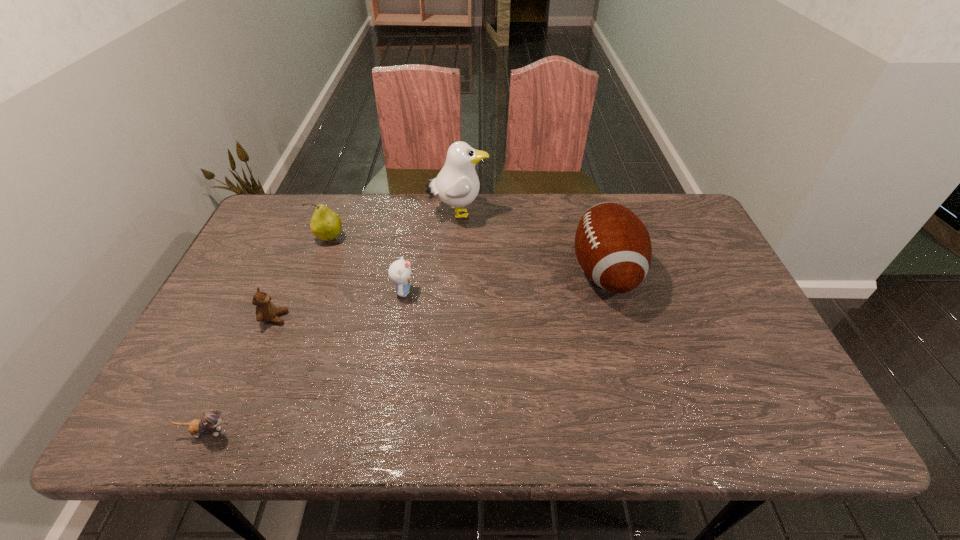
Where is `empty location between the farthest object and the third tallest object`? empty location between the farthest object and the third tallest object is located at coordinates (394, 226).

Locate an element on the screen. object that is the second closest to the left kitten is located at coordinates (399, 271).

The image size is (960, 540). In order to click on the fourth closest object to the teddy bear in this screenshot , I will do coord(457,184).

Locate an element on the screen. The width and height of the screenshot is (960, 540). vacant space that satisfies the following two spatial constraints: 1. on the front side of the pear; 2. on the front-facing side of the left kitten is located at coordinates (256, 432).